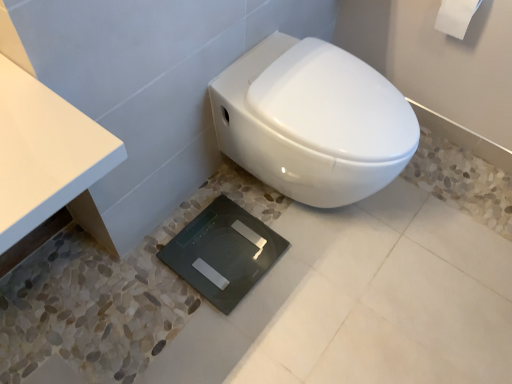
At what (x,y) coordinates should I click in order to perform the action: click on blank area beneath black glass scale at center (from a real-world perspective). Please return your answer as a coordinate pair (x, y). The width and height of the screenshot is (512, 384). Looking at the image, I should click on (222, 255).